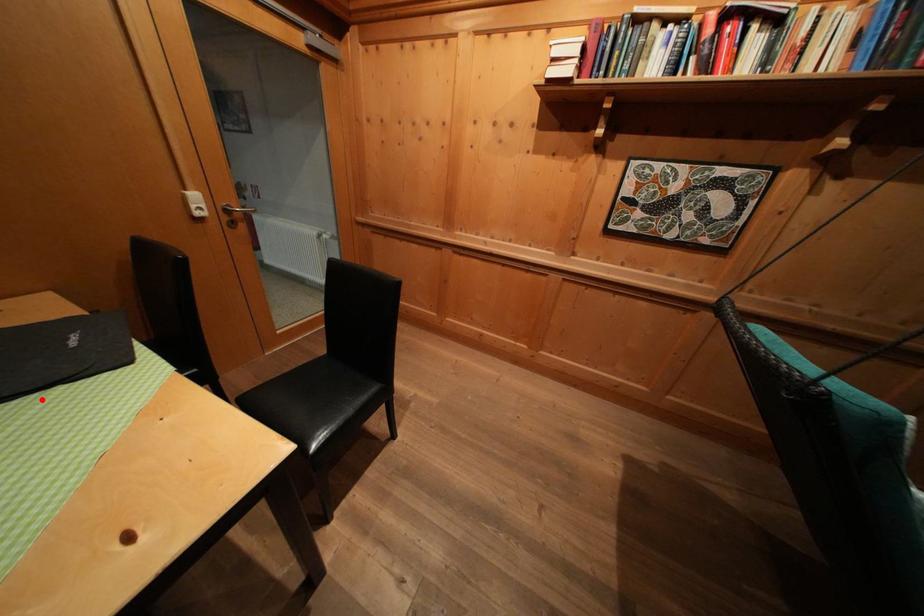
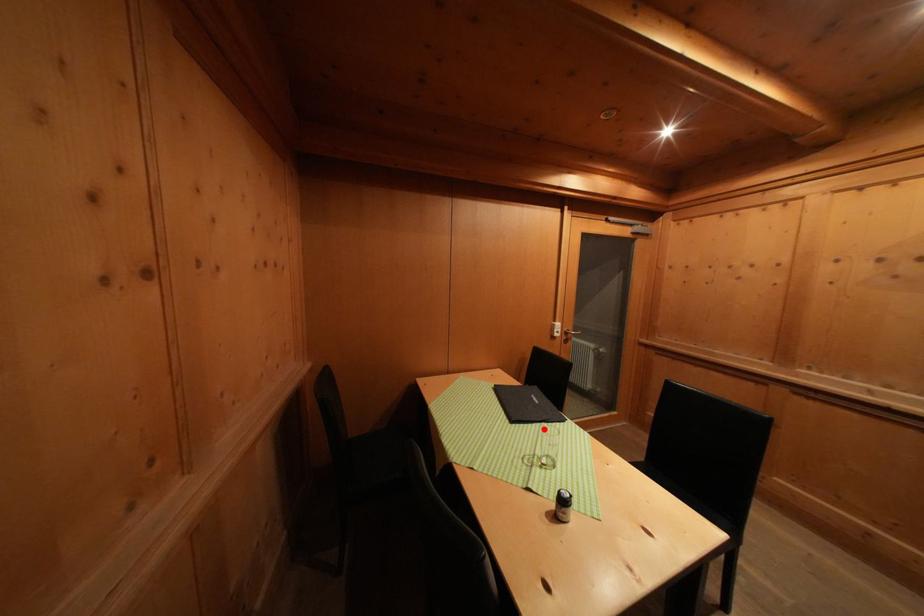
I am providing you with two images of the same scene from different viewpoints. A red point is marked on the first image and another point is marked on the second image. Does the point marked in image1 correspond to the same location as the one in image2?

Yes